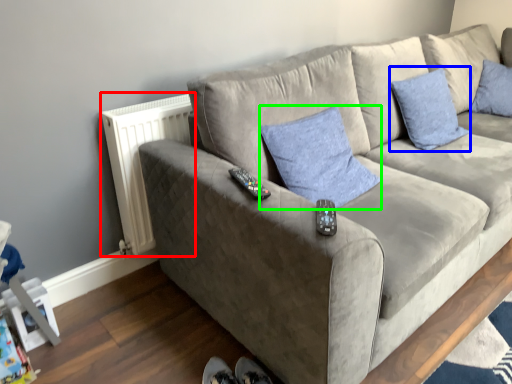
Question: Considering the real-world distances, which object is farthest from radiator (highlighted by a red box)? pillow (highlighted by a blue box) or pillow (highlighted by a green box)?

Choices:
 (A) pillow
 (B) pillow

Answer: (A)